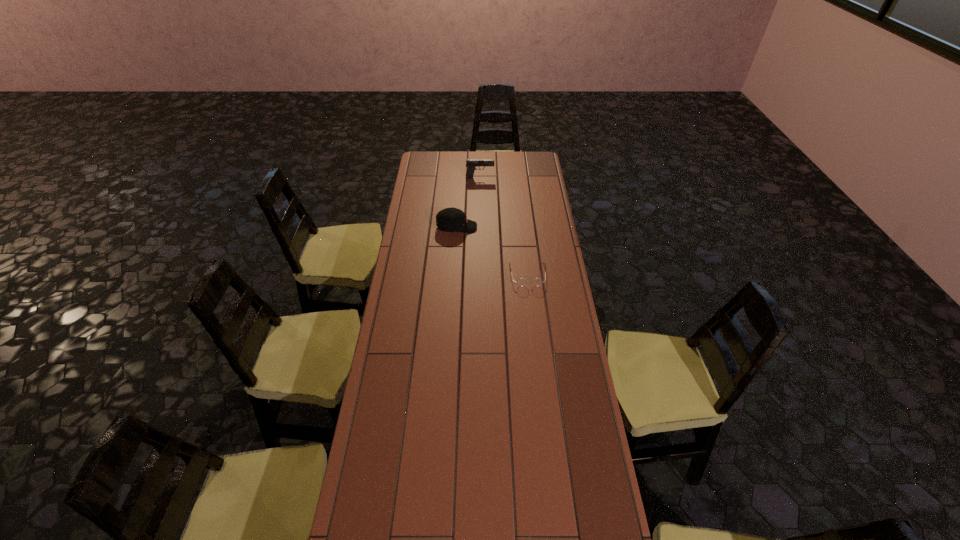
I want to click on vacant space at the left edge of the desktop, so click(415, 231).

The height and width of the screenshot is (540, 960). In the image, there is a desktop. Find the location of `free region at the right edge`. free region at the right edge is located at coordinates 536,190.

Identify the location of vacant area at the far left corner of the desktop. (440, 171).

The width and height of the screenshot is (960, 540). In the image, there is a desktop. What are the coordinates of `vacant space at the far right corner` in the screenshot? It's located at (526, 172).

Where is `vacant area that lies between the second nearest object and the nearest object`? The height and width of the screenshot is (540, 960). vacant area that lies between the second nearest object and the nearest object is located at coordinates (492, 251).

Locate an element on the screen. Image resolution: width=960 pixels, height=540 pixels. empty space between the rightmost object and the pistol is located at coordinates (504, 226).

Locate an element on the screen. free spot between the farthest object and the shortest object is located at coordinates (504, 226).

Identify which object is located as the second nearest to the farthest object. Please provide its 2D coordinates. Your answer should be formatted as a tuple, i.e. [(x, y)], where the tuple contains the x and y coordinates of a point satisfying the conditions above.

[(522, 281)]

At what (x,y) coordinates should I click in order to perform the action: click on the second closest object to the farthest object. Please return your answer as a coordinate pair (x, y). Looking at the image, I should click on (522, 281).